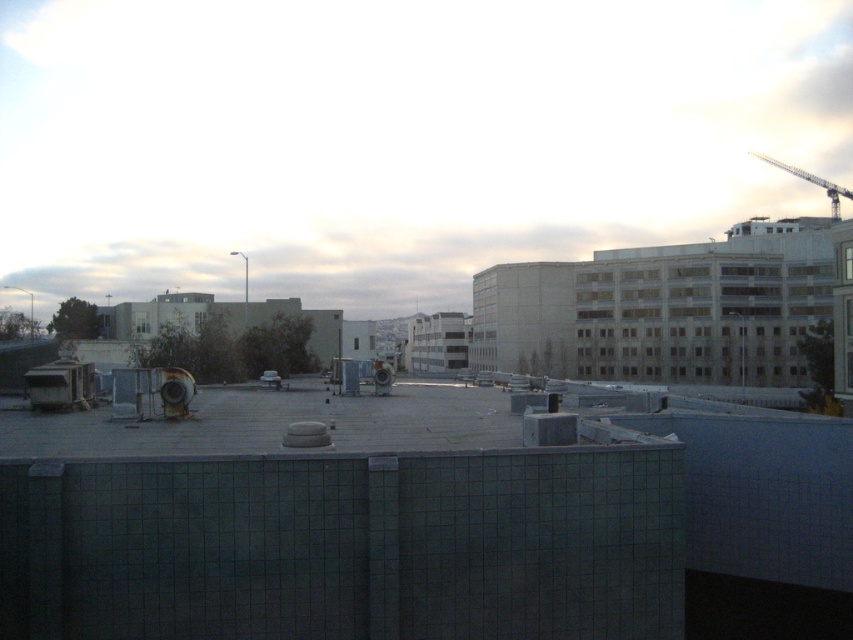
Does gray concrete wall at center have a larger size compared to metallic gray crane at upper right?

No, gray concrete wall at center is not bigger than metallic gray crane at upper right.

Between point (277, 442) and point (810, 173), which one is positioned in front?

Positioned in front is point (277, 442).

Image resolution: width=853 pixels, height=640 pixels. Identify the location of gray concrete wall at center. (422, 522).